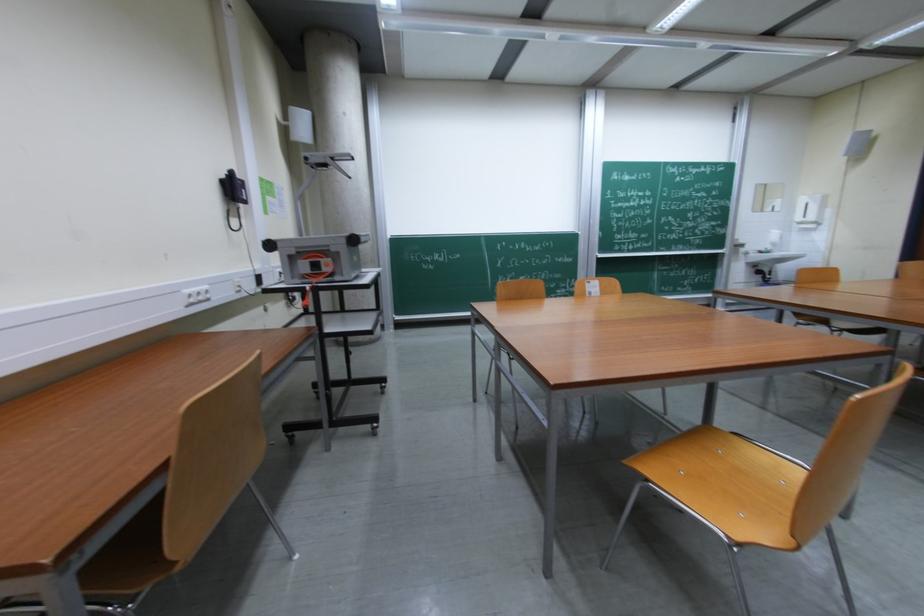
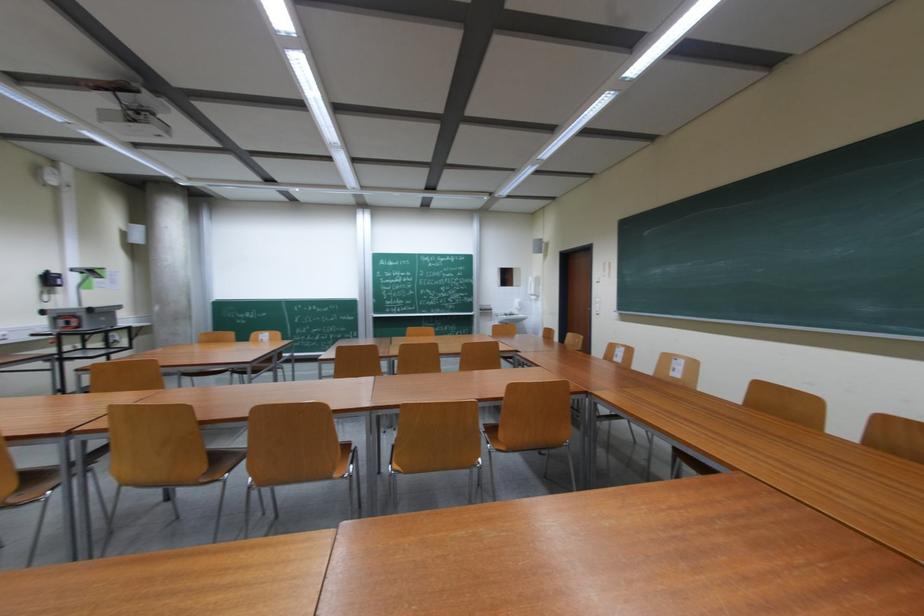
What movement of the cameraman would produce the second image?

The movement direction of the cameraman is right, backward.